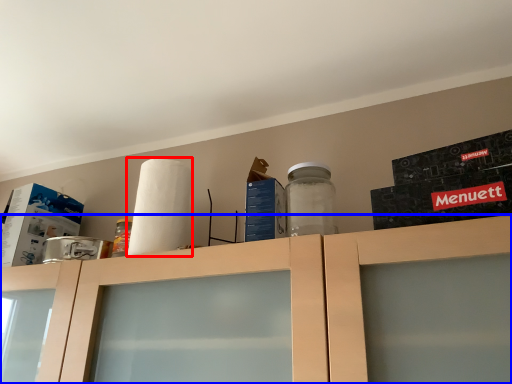
Question: Which point is closer to the camera, paper towel (highlighted by a red box) or cabinetry (highlighted by a blue box)?

Choices:
 (A) paper towel
 (B) cabinetry

Answer: (B)